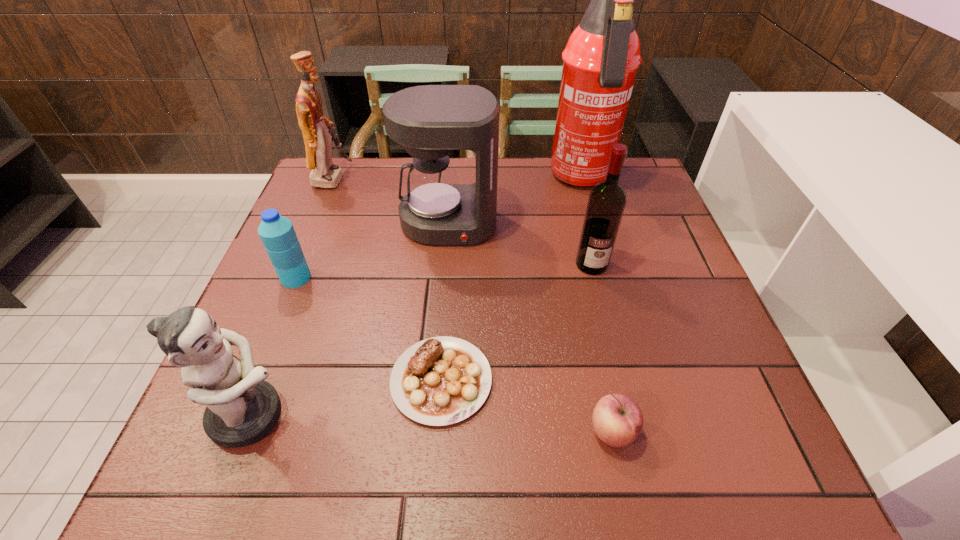
The width and height of the screenshot is (960, 540). Find the location of `apple situated at the near edge`. apple situated at the near edge is located at coordinates (617, 420).

Where is `nutcracker present at the left edge`? This screenshot has width=960, height=540. nutcracker present at the left edge is located at coordinates (318, 144).

Identify the location of figurine that is positioned at the left edge. click(x=241, y=409).

The image size is (960, 540). What are the coordinates of `water bottle located in the left edge section of the desktop` in the screenshot? It's located at (277, 233).

I want to click on object at the right edge, so pyautogui.click(x=600, y=61).

Find the location of a particular element. object that is positioned at the far left corner is located at coordinates pos(318,144).

At what (x,y) coordinates should I click in order to perform the action: click on object that is at the near left corner. Please return your answer as a coordinate pair (x, y). Looking at the image, I should click on (241, 409).

Where is `object present at the far right corner`? object present at the far right corner is located at coordinates (600, 61).

What are the coordinates of `vacant space at the far edge` in the screenshot? It's located at (455, 160).

Image resolution: width=960 pixels, height=540 pixels. In the image, there is a desktop. Identify the location of free region at the near edge. (553, 432).